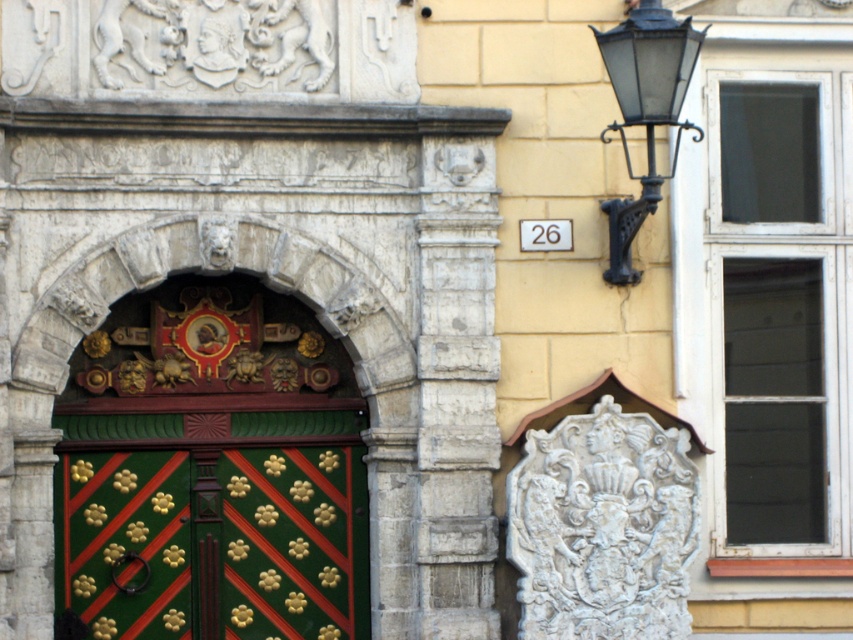
Which of these two, green painted wood door at center or black wrought iron streetlamp at upper right, stands shorter?

green painted wood door at center is shorter.

Who is positioned more to the right, green painted wood door at center or black wrought iron streetlamp at upper right?

black wrought iron streetlamp at upper right

Is point (352, 481) in front of point (619, 97)?

That is False.

Where is `green painted wood door at center`? green painted wood door at center is located at coordinates [x=212, y=541].